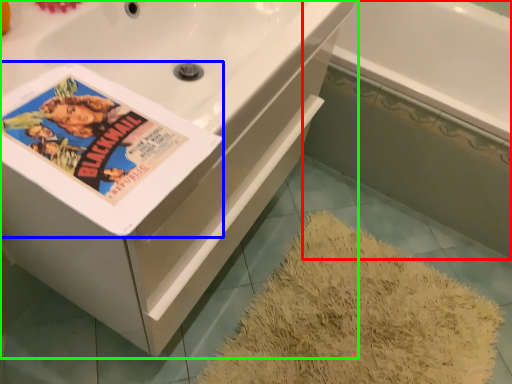
Question: Based on their relative distances, which object is nearer to bath (highlighted by a red box)? Choose from paperback book (highlighted by a blue box) and bathtub (highlighted by a green box).

Choices:
 (A) paperback book
 (B) bathtub

Answer: (B)